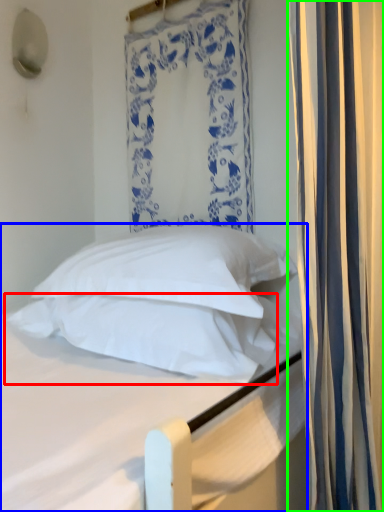
Question: Considering the real-world distances, which object is closest to pillow (highlighted by a red box)? bed (highlighted by a blue box) or curtain (highlighted by a green box).

Choices:
 (A) bed
 (B) curtain

Answer: (A)